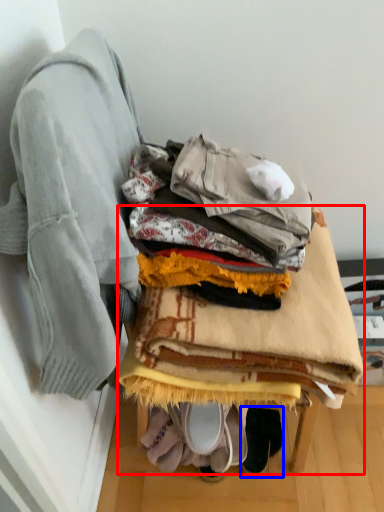
Question: Which point is further to the camera, furniture (highlighted by a red box) or footwear (highlighted by a blue box)?

Choices:
 (A) furniture
 (B) footwear

Answer: (B)